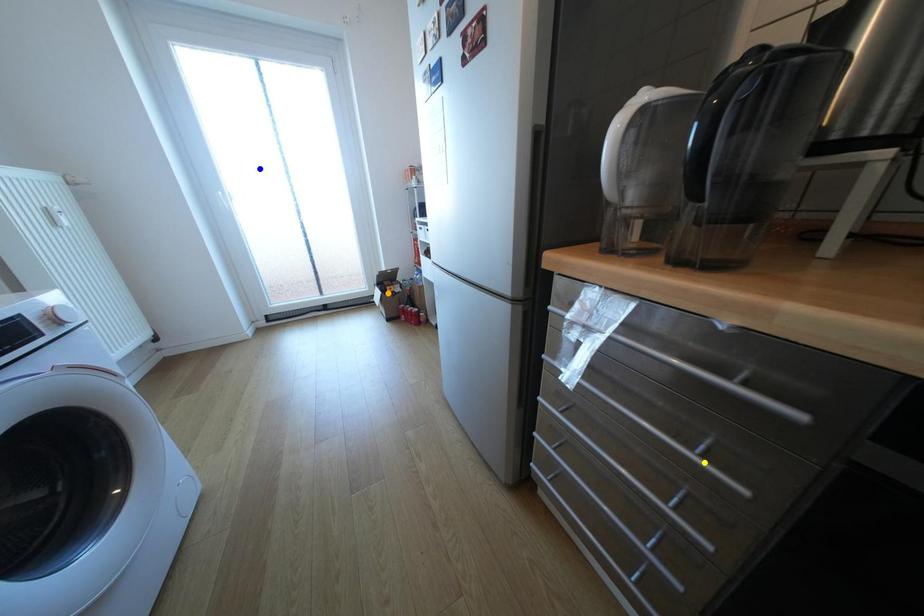
Order these from nearest to farthest:
1. blue point
2. yellow point
3. orange point

yellow point < blue point < orange point